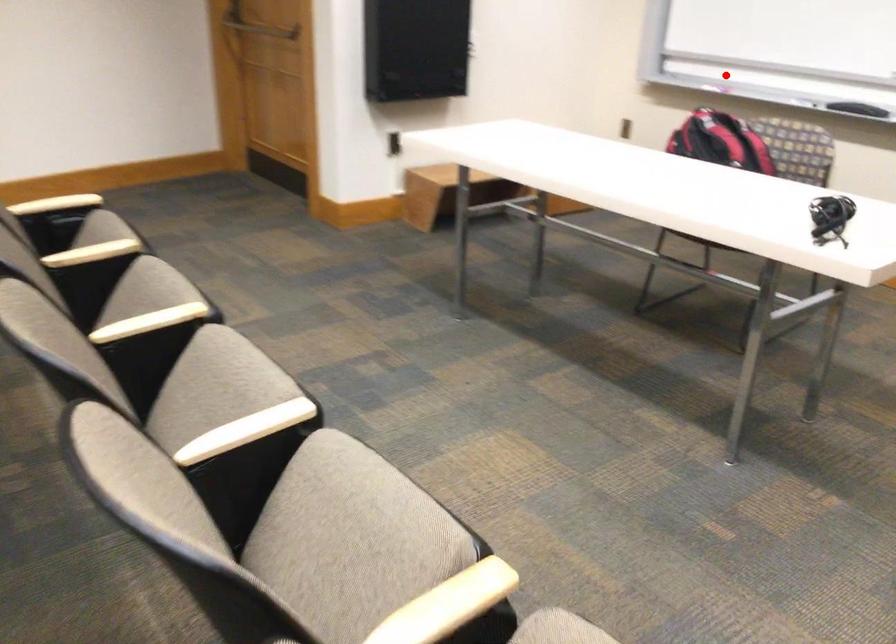
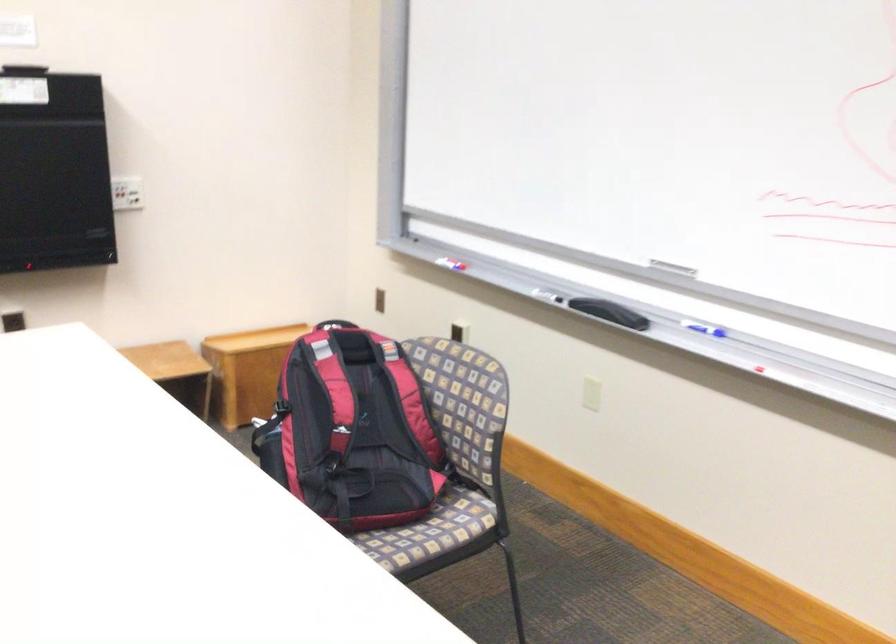
The point at the highlighted location is marked in the first image. Where is the corresponding point in the second image?

(451, 261)